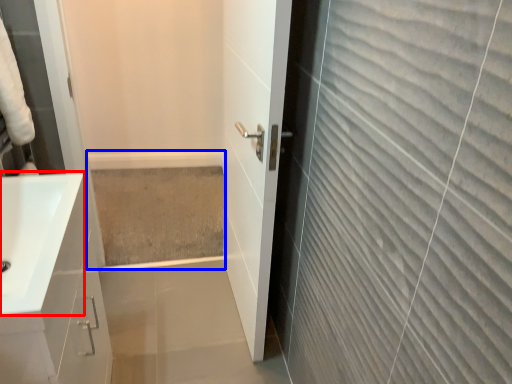
Question: Which of the following is the farthest to the observer, sink (highlighted by a red box) or bath (highlighted by a blue box)?

Choices:
 (A) sink
 (B) bath

Answer: (B)